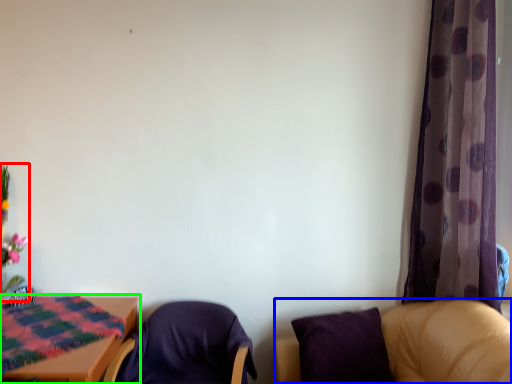
Question: Based on their relative distances, which object is nearer to floral arrangement (highlighted by a red box)? Choose from chair (highlighted by a blue box) and table (highlighted by a green box).

Choices:
 (A) chair
 (B) table

Answer: (B)